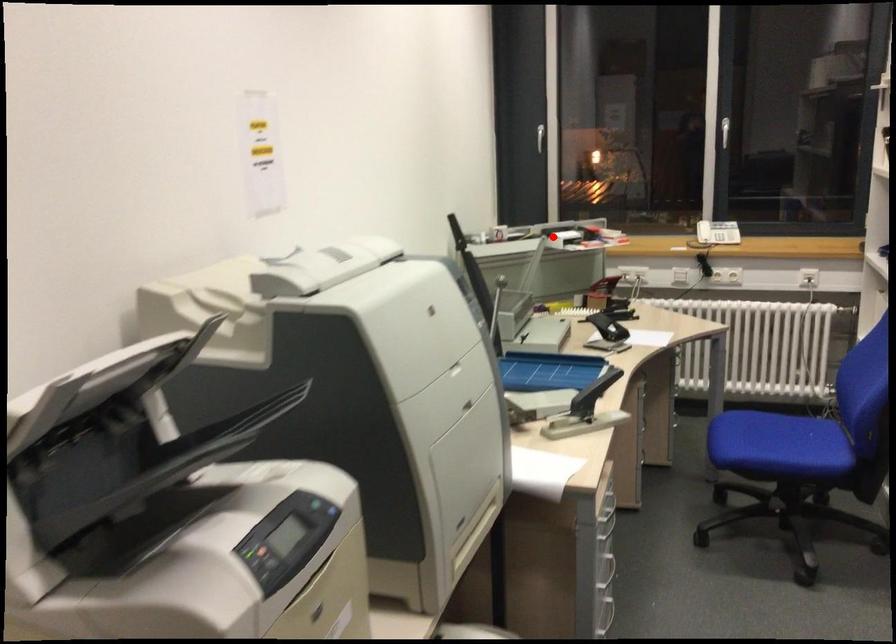
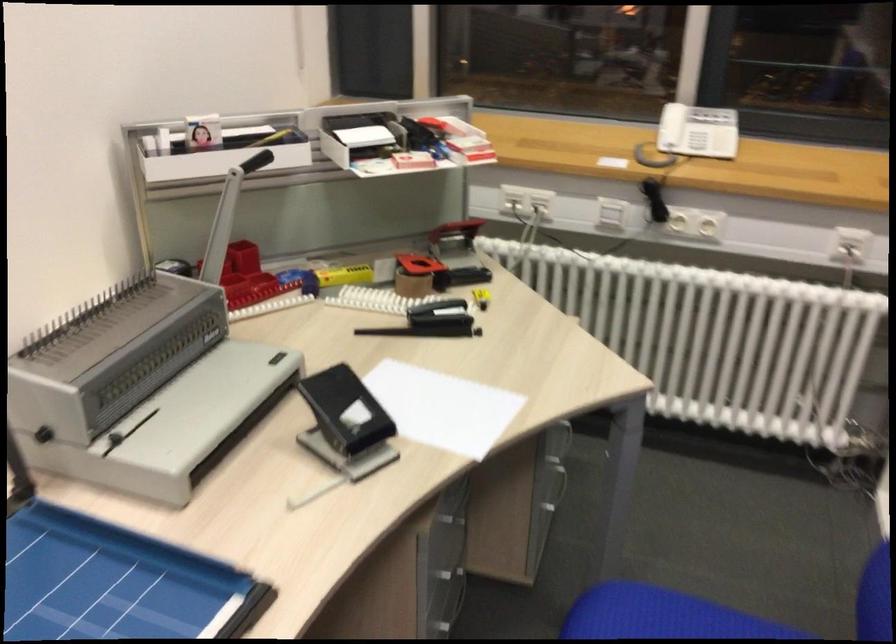
Where in the second image is the point corresponding to the highlighted location from the first image?

(334, 149)